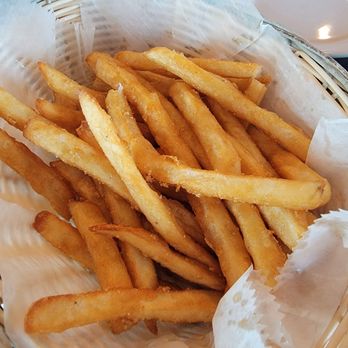
What are the coordinates of `crumb` in the screenshot? It's located at (177, 189).